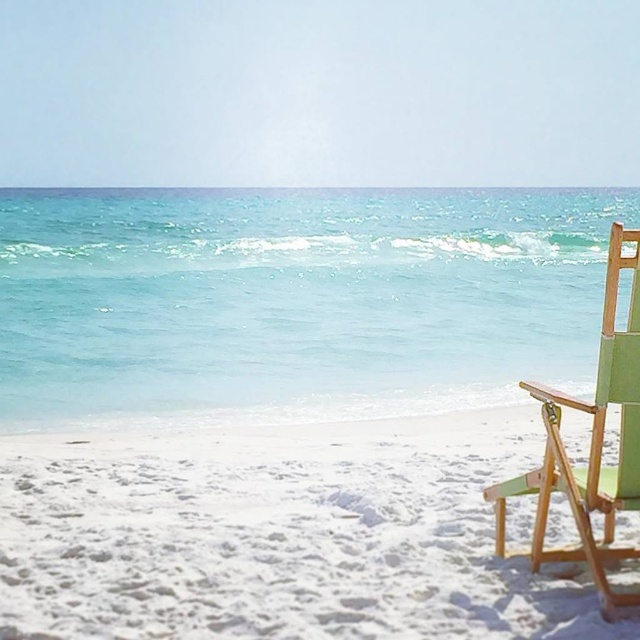
Which of these two, white sandy beach at lower right or green fabric chair at right, stands shorter?

white sandy beach at lower right

Can you confirm if white sandy beach at lower right is positioned to the right of green fabric chair at right?

In fact, white sandy beach at lower right is to the left of green fabric chair at right.

Locate an element on the screen. The height and width of the screenshot is (640, 640). white sandy beach at lower right is located at coordinates (278, 532).